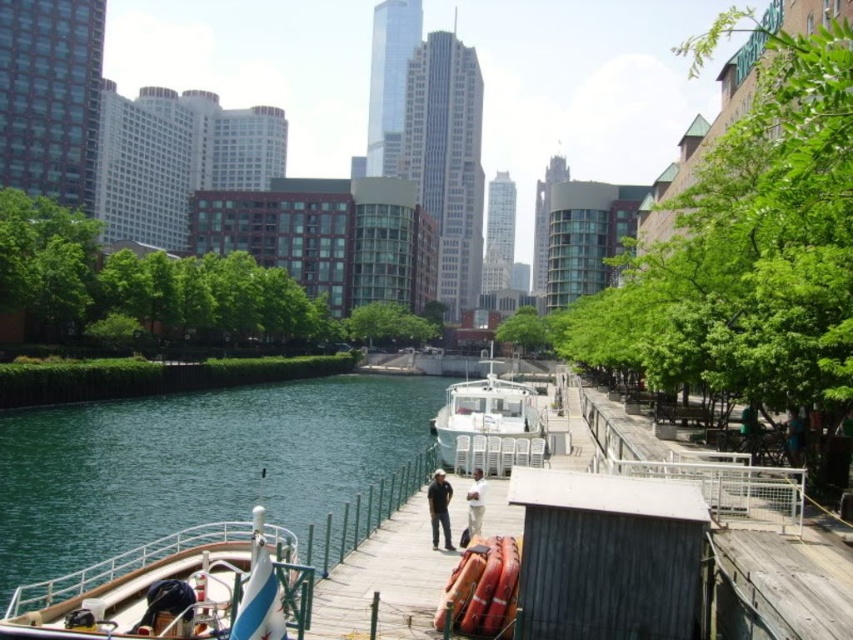
You are a photographer standing on the dock and want to take a photo of the wooden polished boat at lower left without the light beige fabric at center casting a shadow on it. What should you do?

Move the wooden polished boat at lower left to a position not under the light beige fabric at center to avoid the shadow.

You are a delivery person needing to place a large package on the light beige fabric at center. The wooden polished boat at lower left is in the way. Can you move the boat to make space?

The wooden polished boat at lower left might be wider than light beige fabric at center, so moving it could be necessary to create enough space for the large package.